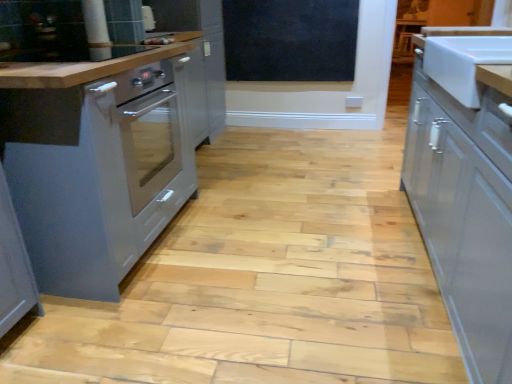
The image size is (512, 384). Describe the element at coordinates (290, 39) in the screenshot. I see `black matte chalkboard at upper center` at that location.

The width and height of the screenshot is (512, 384). Find the location of `white glossy cabinet at right, arranged as the second cabinetry when viewed from the left`. white glossy cabinet at right, arranged as the second cabinetry when viewed from the left is located at coordinates (465, 186).

You are a GUI agent. You are given a task and a screenshot of the screen. Output one action in this format:
    pyautogui.click(x=<x>, y=<y>)
    Task: Click on the white glossy sink at right
    Image resolution: width=512 pixels, height=384 pixels.
    Given the screenshot: What is the action you would take?
    pyautogui.click(x=463, y=62)

What is the approximate width of satin grey cabinet at left, which is the 2th cabinetry from right to left?

The width of satin grey cabinet at left, which is the 2th cabinetry from right to left, is 36.57 inches.

Image resolution: width=512 pixels, height=384 pixels. I want to click on satin grey cabinet at left, which is the 2th cabinetry from right to left, so click(103, 132).

Locate an element on the screen. black matte chalkboard at upper center is located at coordinates (290, 39).

What's the angular difference between satin grey cabinet at left, which is the 2th cabinetry from right to left, and white glossy sink at right's facing directions?

satin grey cabinet at left, which is the 2th cabinetry from right to left, and white glossy sink at right are facing 179 degrees away from each other.

Considering their positions, is satin grey cabinet at left, the first cabinetry in the left-to-right sequence, located in front of or behind white glossy sink at right?

Visually, satin grey cabinet at left, the first cabinetry in the left-to-right sequence, is located behind white glossy sink at right.

Is satin grey cabinet at left, the first cabinetry in the left-to-right sequence, at the right side of white glossy sink at right?

Incorrect, satin grey cabinet at left, the first cabinetry in the left-to-right sequence, is not on the right side of white glossy sink at right.

The height and width of the screenshot is (384, 512). What are the coordinates of `cabinetry on the left of white glossy sink at right` in the screenshot? It's located at (103, 132).

In the image, is white glossy sink at right positioned in front of or behind satin grey cabinet at left, the first cabinetry in the left-to-right sequence?

white glossy sink at right is positioned closer to the viewer than satin grey cabinet at left, the first cabinetry in the left-to-right sequence.

How much distance is there between white glossy sink at right and satin grey cabinet at left, which is the 2th cabinetry from right to left?

white glossy sink at right and satin grey cabinet at left, which is the 2th cabinetry from right to left, are 1.33 meters apart from each other.

The image size is (512, 384). I want to click on sink that appears in front of the satin grey cabinet at left, which is the 2th cabinetry from right to left, so click(x=463, y=62).

Is white glossy sink at right spatially inside satin grey cabinet at left, the first cabinetry in the left-to-right sequence, or outside of it?

white glossy sink at right is located beyond the bounds of satin grey cabinet at left, the first cabinetry in the left-to-right sequence.

From a real-world perspective, between satin grey cabinet at left, which is the 2th cabinetry from right to left, and white glossy cabinet at right, placed as the 1th cabinetry when sorted from right to left, who is vertically higher?

white glossy cabinet at right, placed as the 1th cabinetry when sorted from right to left, is physically above.

Is there a large distance between satin grey cabinet at left, which is the 2th cabinetry from right to left, and white glossy cabinet at right, placed as the 1th cabinetry when sorted from right to left?

Yes, satin grey cabinet at left, which is the 2th cabinetry from right to left, is far from white glossy cabinet at right, placed as the 1th cabinetry when sorted from right to left.

Can you confirm if white glossy sink at right is positioned to the left of white glossy cabinet at right, arranged as the second cabinetry when viewed from the left?

Indeed, white glossy sink at right is positioned on the left side of white glossy cabinet at right, arranged as the second cabinetry when viewed from the left.

This screenshot has height=384, width=512. I want to click on cabinetry that is on the right side of white glossy sink at right, so click(x=465, y=186).

In the scene shown: Which of these two, white glossy sink at right or white glossy cabinet at right, arranged as the second cabinetry when viewed from the left, stands taller?

Standing taller between the two is white glossy cabinet at right, arranged as the second cabinetry when viewed from the left.

Is white glossy sink at right oriented towards white glossy cabinet at right, placed as the 1th cabinetry when sorted from right to left?

No, white glossy sink at right is not facing towards white glossy cabinet at right, placed as the 1th cabinetry when sorted from right to left.

From a real-world perspective, is black matte chalkboard at upper center under white glossy sink at right?

Indeed, from a real-world perspective, black matte chalkboard at upper center is positioned beneath white glossy sink at right.

From the image's perspective, is black matte chalkboard at upper center located above white glossy sink at right?

Yes, from the image's perspective, black matte chalkboard at upper center is over white glossy sink at right.

Which of these two, black matte chalkboard at upper center or white glossy sink at right, is smaller?

black matte chalkboard at upper center is smaller.

Is black matte chalkboard at upper center looking in the opposite direction of white glossy sink at right?

black matte chalkboard at upper center is not turned away from white glossy sink at right.

In the scene shown: Would you say black matte chalkboard at upper center is inside or outside satin grey cabinet at left, which is the 2th cabinetry from right to left?

black matte chalkboard at upper center exists outside the volume of satin grey cabinet at left, which is the 2th cabinetry from right to left.

From the image's perspective, would you say black matte chalkboard at upper center is shown under satin grey cabinet at left, which is the 2th cabinetry from right to left?

No.

Which is more to the left, black matte chalkboard at upper center or satin grey cabinet at left, the first cabinetry in the left-to-right sequence?

Positioned to the left is satin grey cabinet at left, the first cabinetry in the left-to-right sequence.

In the image, is black matte chalkboard at upper center positioned in front of or behind satin grey cabinet at left, which is the 2th cabinetry from right to left?

Clearly, black matte chalkboard at upper center is behind satin grey cabinet at left, which is the 2th cabinetry from right to left.

Is satin grey cabinet at left, which is the 2th cabinetry from right to left, shorter than black matte chalkboard at upper center?

Incorrect, the height of satin grey cabinet at left, which is the 2th cabinetry from right to left, does not fall short of that of black matte chalkboard at upper center.

In the scene shown: Considering the sizes of objects satin grey cabinet at left, which is the 2th cabinetry from right to left, and black matte chalkboard at upper center in the image provided, who is thinner, satin grey cabinet at left, which is the 2th cabinetry from right to left, or black matte chalkboard at upper center?

black matte chalkboard at upper center is thinner.

Who is bigger, satin grey cabinet at left, which is the 2th cabinetry from right to left, or black matte chalkboard at upper center?

satin grey cabinet at left, which is the 2th cabinetry from right to left.

This screenshot has width=512, height=384. What are the coordinates of `sink that appears above the satin grey cabinet at left, which is the 2th cabinetry from right to left (from the image's perspective)` in the screenshot? It's located at (463, 62).

From a real-world perspective, starting from the white glossy sink at right, which cabinetry is the 2nd one below it? Please provide its 2D coordinates.

[(103, 132)]

In the scene shown: Looking at the image, which one is located further to satin grey cabinet at left, which is the 2th cabinetry from right to left, black matte chalkboard at upper center or white glossy sink at right?

The object further to satin grey cabinet at left, which is the 2th cabinetry from right to left, is black matte chalkboard at upper center.

Based on their spatial positions, is black matte chalkboard at upper center or satin grey cabinet at left, the first cabinetry in the left-to-right sequence, closer to white glossy sink at right?

Among the two, satin grey cabinet at left, the first cabinetry in the left-to-right sequence, is located nearer to white glossy sink at right.

Looking at the image, which one is located further to white glossy cabinet at right, arranged as the second cabinetry when viewed from the left, satin grey cabinet at left, which is the 2th cabinetry from right to left, or white glossy sink at right?

satin grey cabinet at left, which is the 2th cabinetry from right to left, is positioned further to the anchor white glossy cabinet at right, arranged as the second cabinetry when viewed from the left.

Which object lies further to the anchor point white glossy cabinet at right, placed as the 1th cabinetry when sorted from right to left, white glossy sink at right or black matte chalkboard at upper center?

black matte chalkboard at upper center is further to white glossy cabinet at right, placed as the 1th cabinetry when sorted from right to left.

Which object lies nearer to the anchor point black matte chalkboard at upper center, white glossy cabinet at right, placed as the 1th cabinetry when sorted from right to left, or satin grey cabinet at left, the first cabinetry in the left-to-right sequence?

Based on the image, satin grey cabinet at left, the first cabinetry in the left-to-right sequence, appears to be nearer to black matte chalkboard at upper center.

Considering their positions, is satin grey cabinet at left, which is the 2th cabinetry from right to left, positioned closer to white glossy sink at right than white glossy cabinet at right, placed as the 1th cabinetry when sorted from right to left?

white glossy cabinet at right, placed as the 1th cabinetry when sorted from right to left.

From the picture: From the image, which object appears to be farther from black matte chalkboard at upper center, satin grey cabinet at left, which is the 2th cabinetry from right to left, or white glossy sink at right?

white glossy sink at right lies further to black matte chalkboard at upper center than the other object.

Considering their positions, is white glossy sink at right positioned closer to satin grey cabinet at left, the first cabinetry in the left-to-right sequence, than black matte chalkboard at upper center?

The object closer to satin grey cabinet at left, the first cabinetry in the left-to-right sequence, is white glossy sink at right.

Where is `cabinetry located between white glossy sink at right and black matte chalkboard at upper center in the depth direction`? This screenshot has height=384, width=512. cabinetry located between white glossy sink at right and black matte chalkboard at upper center in the depth direction is located at coordinates (103, 132).

The height and width of the screenshot is (384, 512). What are the coordinates of `sink between satin grey cabinet at left, the first cabinetry in the left-to-right sequence, and white glossy cabinet at right, arranged as the second cabinetry when viewed from the left, from left to right` in the screenshot? It's located at (463, 62).

Find the location of a particular element. This screenshot has height=384, width=512. sink located between white glossy cabinet at right, placed as the 1th cabinetry when sorted from right to left, and black matte chalkboard at upper center in the depth direction is located at coordinates (463, 62).

Where is `cabinetry positioned between white glossy cabinet at right, arranged as the second cabinetry when viewed from the left, and black matte chalkboard at upper center from near to far`? This screenshot has width=512, height=384. cabinetry positioned between white glossy cabinet at right, arranged as the second cabinetry when viewed from the left, and black matte chalkboard at upper center from near to far is located at coordinates (103, 132).